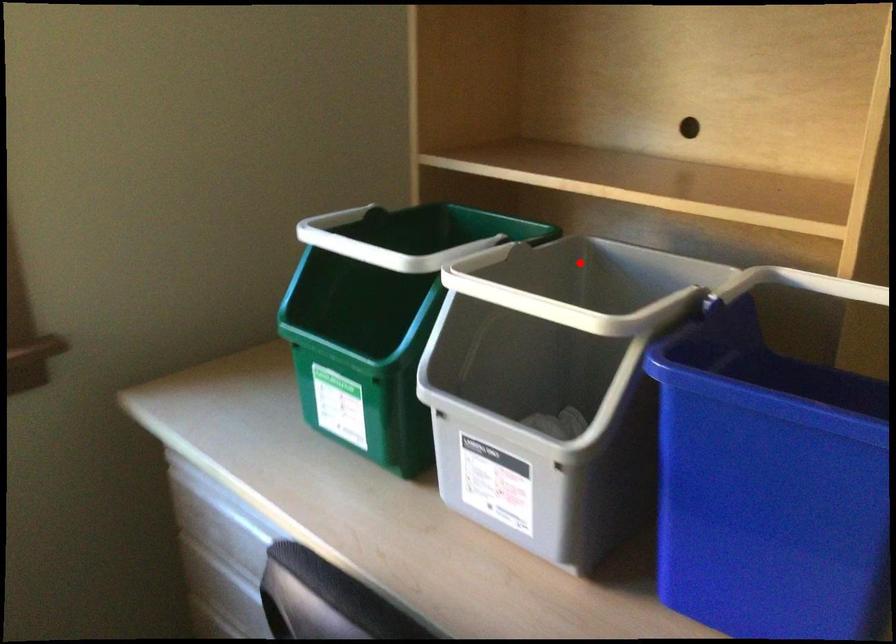
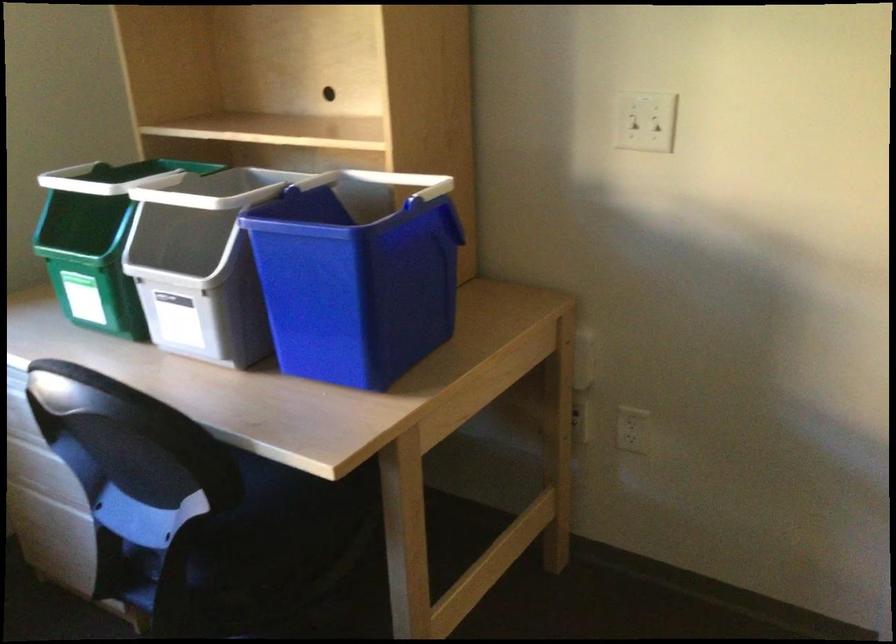
Question: I am providing you with two images of the same scene from different viewpoints. A red point is shown in image1. For the corresponding object point in image2, is it positioned nearer or farther from the camera?

Choices:
 (A) Nearer
 (B) Farther

Answer: (B)